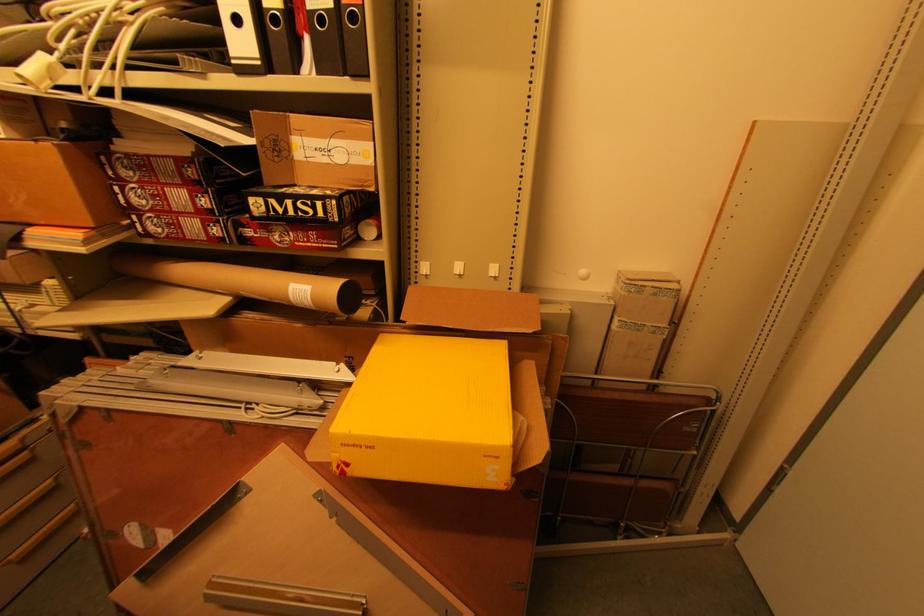
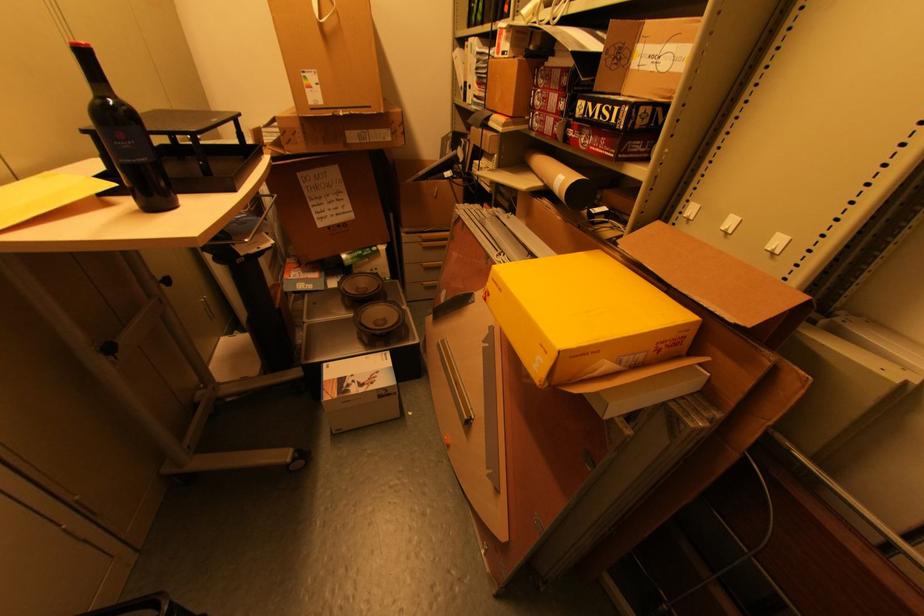
Locate, in the second image, the point that corresponds to point (493, 331) in the first image.

(688, 294)